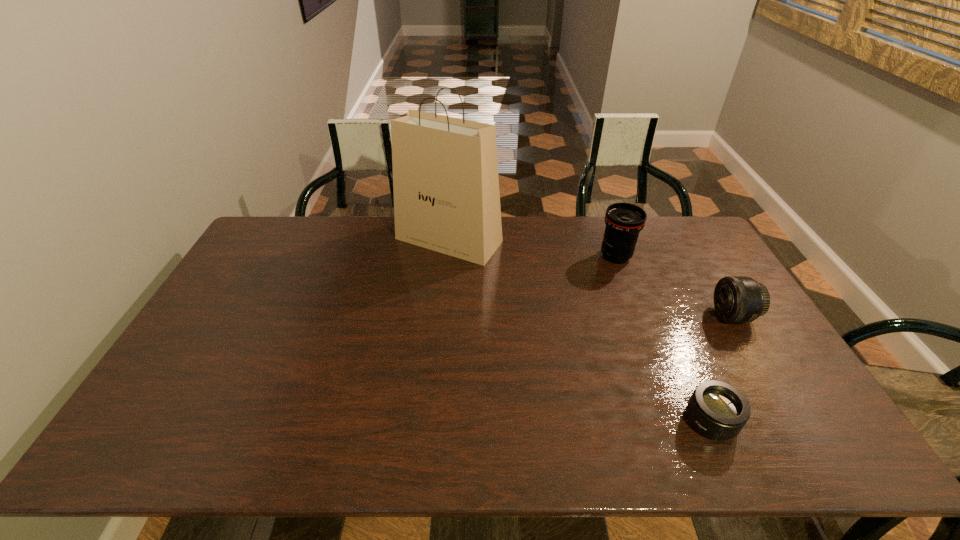
You are a GUI agent. You are given a task and a screenshot of the screen. Output one action in this format:
    pyautogui.click(x=<x>, y=<y>)
    Task: Click on the vacant space at the far edge
    
    Given the screenshot: What is the action you would take?
    pyautogui.click(x=357, y=234)

You are a GUI agent. You are given a task and a screenshot of the screen. Output one action in this format:
    pyautogui.click(x=<x>, y=<y>)
    Task: Click on the vacant space at the near edge
    
    Given the screenshot: What is the action you would take?
    pyautogui.click(x=681, y=449)

Image resolution: width=960 pixels, height=540 pixels. Find the location of `vacant area at the left edge`. vacant area at the left edge is located at coordinates (262, 268).

This screenshot has width=960, height=540. I want to click on vacant space at the far right corner of the desktop, so click(673, 225).

I want to click on free space between the nearest telephoto lens and the second nearest object, so click(x=721, y=368).

The width and height of the screenshot is (960, 540). I want to click on blank region between the second farthest telephoto lens and the farthest telephoto lens, so click(674, 286).

Find the location of `vacant area that lies between the nearest telephoto lens and the third shortest object`. vacant area that lies between the nearest telephoto lens and the third shortest object is located at coordinates (663, 339).

Where is `vacant area between the third tallest object and the third shortest object`? This screenshot has width=960, height=540. vacant area between the third tallest object and the third shortest object is located at coordinates (674, 286).

The width and height of the screenshot is (960, 540). I want to click on free space that is in between the farthest telephoto lens and the nearest telephoto lens, so click(663, 339).

I want to click on blank region between the shopping bag and the tallest telephoto lens, so click(x=532, y=248).